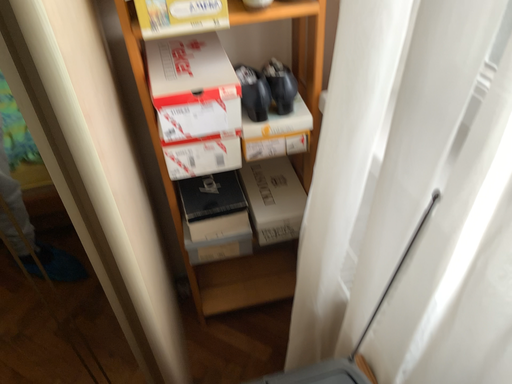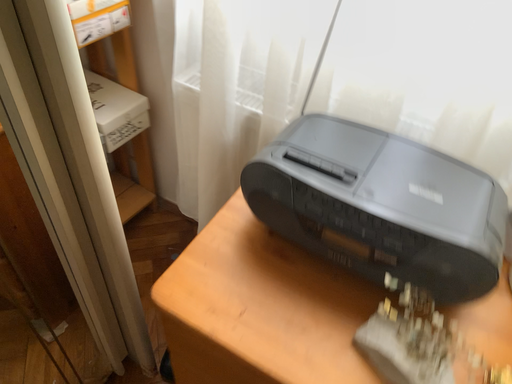
Question: How did the camera likely rotate when shooting the video?

Choices:
 (A) rotated right
 (B) rotated left

Answer: (A)